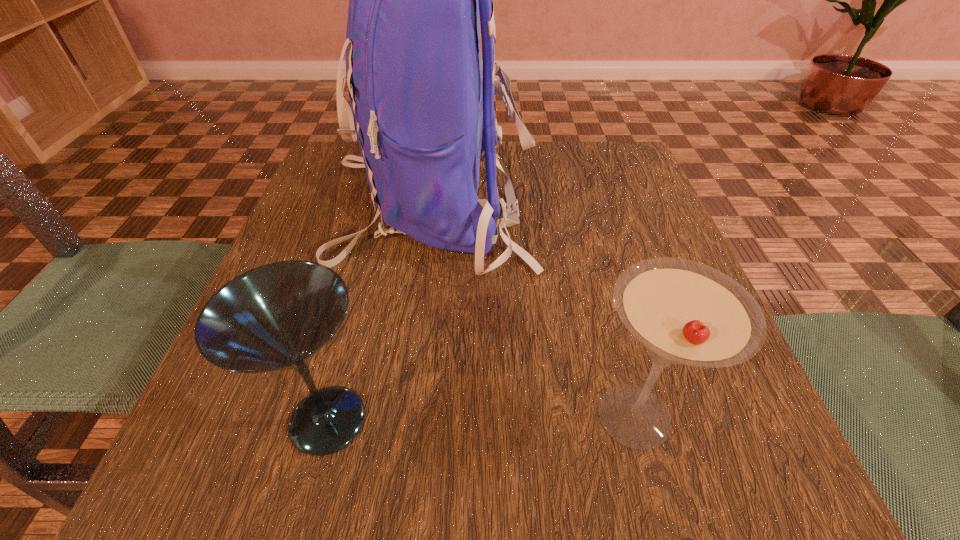
This screenshot has width=960, height=540. Find the location of `backpack`. backpack is located at coordinates (422, 118).

You are a GUI agent. You are given a task and a screenshot of the screen. Output one action in this format:
    pyautogui.click(x=<x>, y=<y>)
    Task: Click on the tallest object
    The height and width of the screenshot is (540, 960).
    Given the screenshot: What is the action you would take?
    pyautogui.click(x=422, y=118)

The width and height of the screenshot is (960, 540). In order to click on the rightmost object in this screenshot , I will do `click(683, 312)`.

Find the location of a particular element. The height and width of the screenshot is (540, 960). the left martini is located at coordinates (277, 316).

Find the location of a particular element. vacant space located on the back of the backpack is located at coordinates (635, 205).

Where is `blank space located on the left of the rightmost object`? blank space located on the left of the rightmost object is located at coordinates (317, 415).

At what (x,y) coordinates should I click in order to perform the action: click on vacant space located 0.390m on the right of the left martini. Please return your answer as a coordinate pair (x, y). Image resolution: width=960 pixels, height=540 pixels. Looking at the image, I should click on (679, 421).

Where is `object at the far edge`? object at the far edge is located at coordinates (422, 118).

The height and width of the screenshot is (540, 960). Find the location of `backpack located at the left edge`. backpack located at the left edge is located at coordinates (422, 118).

You are a GUI agent. You are given a task and a screenshot of the screen. Output one action in this format:
    pyautogui.click(x=<x>, y=<y>)
    Task: Click on the martini that is at the left edge
    
    Given the screenshot: What is the action you would take?
    pyautogui.click(x=277, y=316)